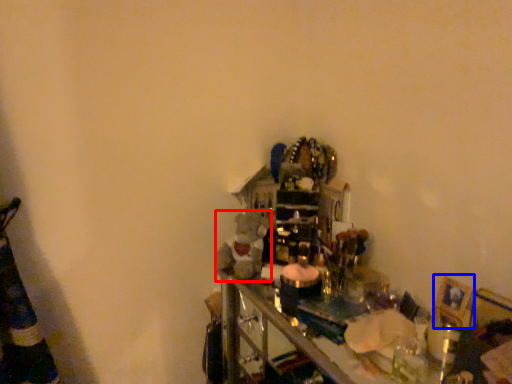
Question: Among these objects, which one is farthest to the camera, toy (highlighted by a red box) or picture frame (highlighted by a blue box)?

Choices:
 (A) toy
 (B) picture frame

Answer: (A)